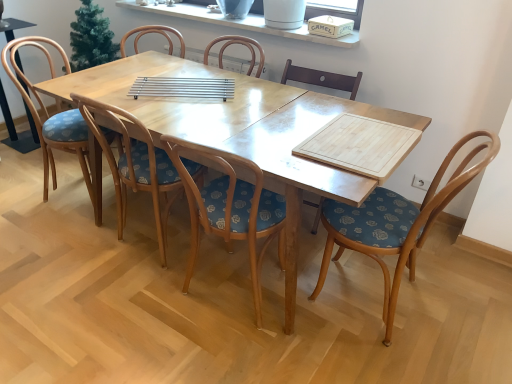
The height and width of the screenshot is (384, 512). I want to click on free space in front of wooden chair with floral upholstery at center, the 3th chair in the left-to-right sequence, so click(x=228, y=357).